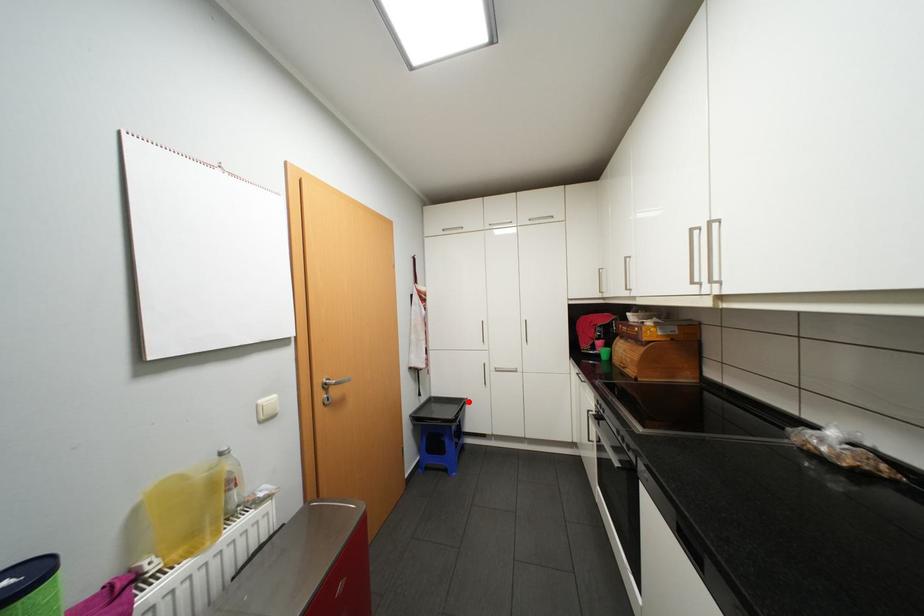
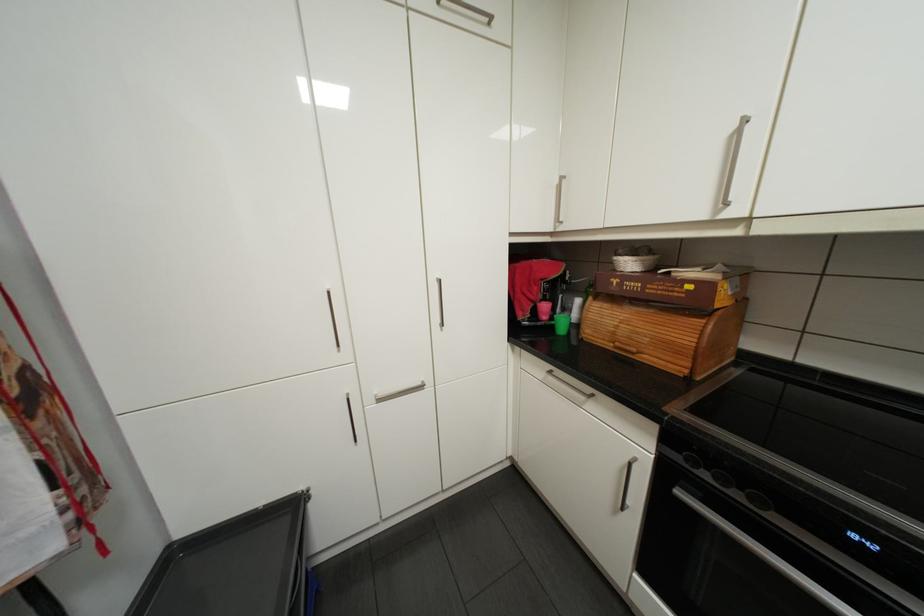
Locate, in the second image, the point that corresponds to the highlighted location in the first image.

(300, 507)